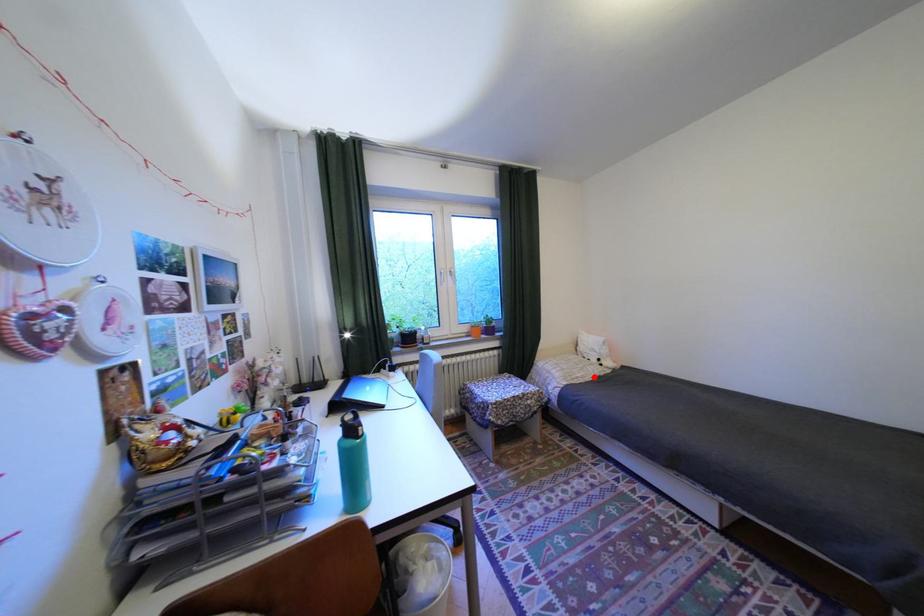
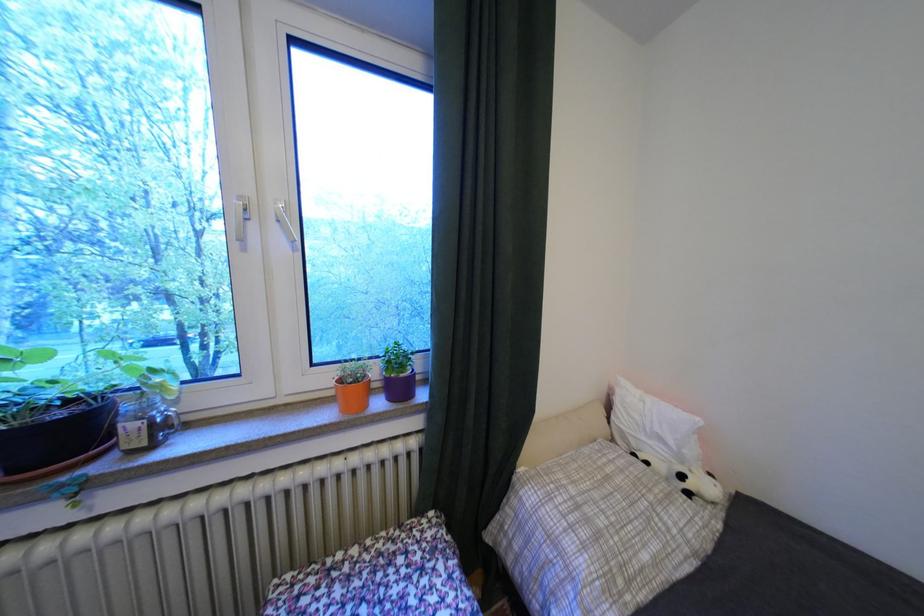
Question: A red point is marked in image1. In image2, is the corresponding 3D point closer to the camera or farther? Reply with the corresponding letter.

Choices:
 (A) The corresponding 3D point is closer.
 (B) The corresponding 3D point is farther.

Answer: (A)